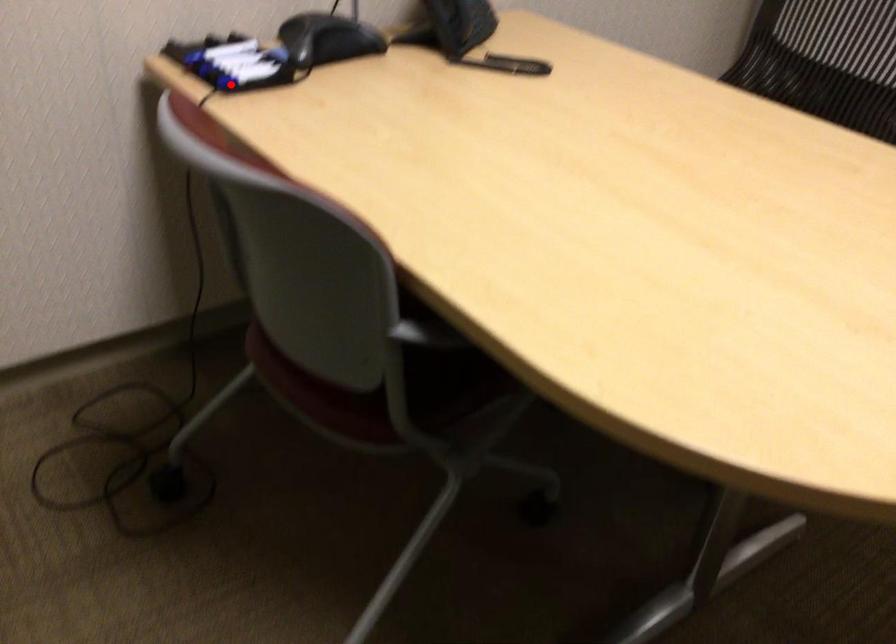
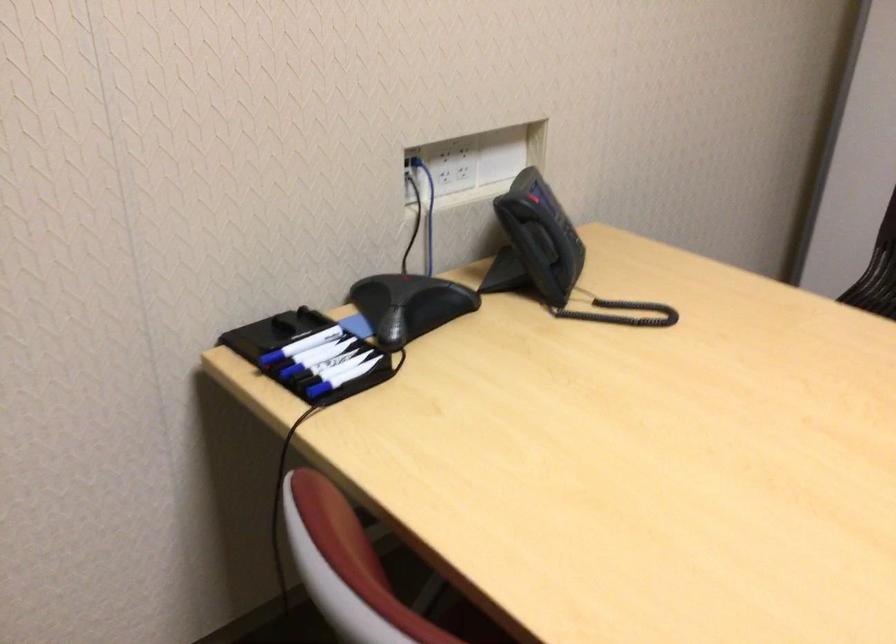
Question: A red point is marked in image1. In image2, is the corresponding 3D point closer to the camera or farther? Reply with the corresponding letter.

Choices:
 (A) The corresponding 3D point is closer.
 (B) The corresponding 3D point is farther.

Answer: (A)